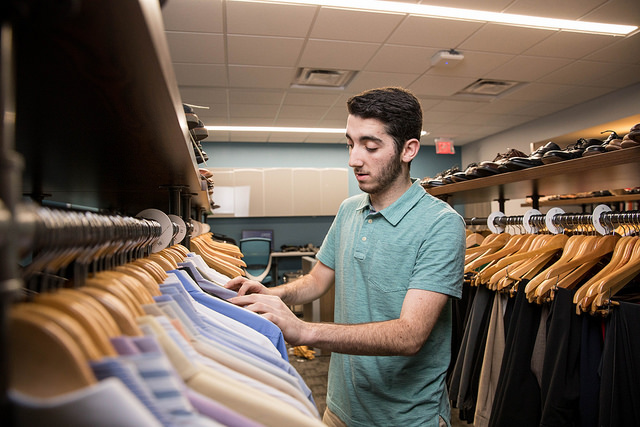
You are a GUI agent. You are given a task and a screenshot of the screen. Output one action in this format:
    pyautogui.click(x=<x>, y=<y>)
    Task: Click on the hanger
    
    Given the screenshot: What is the action you would take?
    pyautogui.click(x=116, y=281)